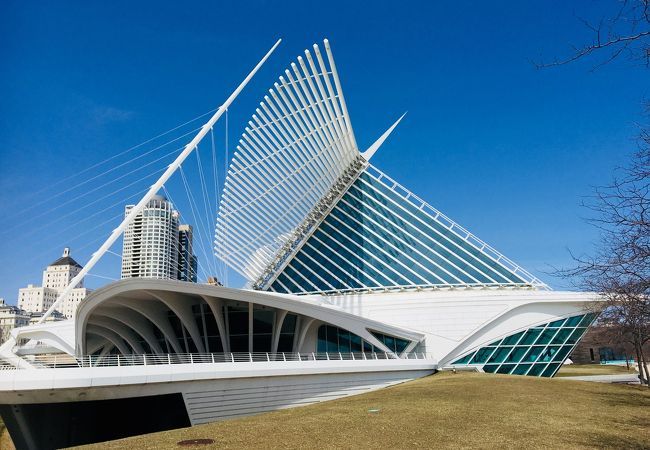
The width and height of the screenshot is (650, 450). Identify the location of window. (535, 352).